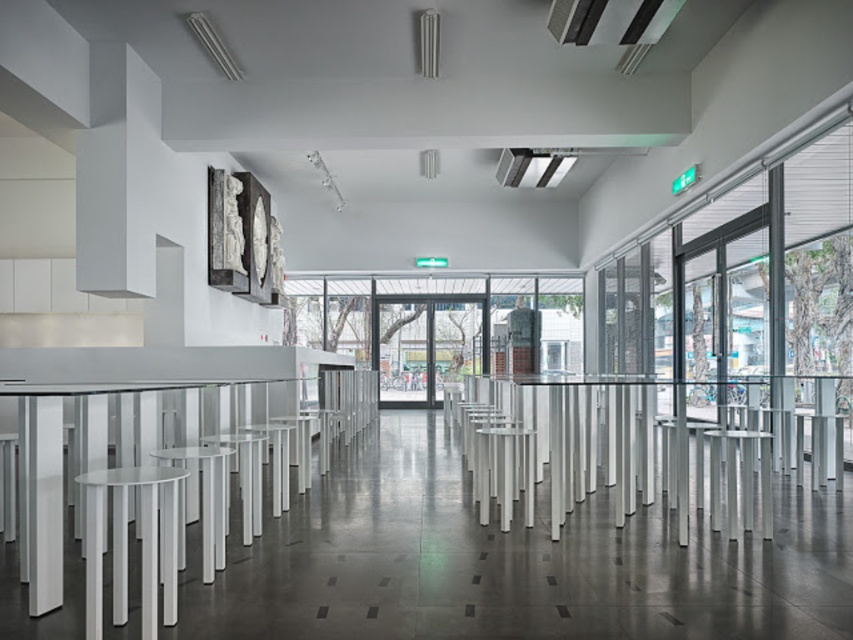
Between white glossy table at left and white plastic bar stool at lower left, which one appears on the left side from the viewer's perspective?

white glossy table at left is more to the left.

Looking at this image, who is higher up, white glossy table at left or white plastic bar stool at lower left?

white glossy table at left is higher up.

Is point (35, 593) closer to viewer compared to point (206, 508)?

Yes, it is in front of point (206, 508).

Where is `white glossy table at left`? white glossy table at left is located at coordinates (57, 474).